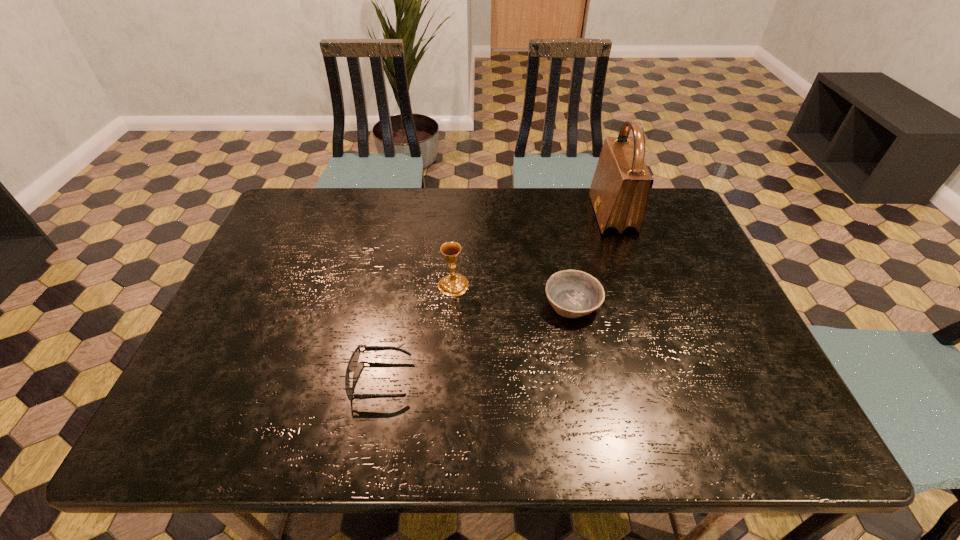
This screenshot has width=960, height=540. I want to click on vacant space that is in between the third object from left to right and the tallest object, so click(x=592, y=259).

Identify which object is the second nearest to the chalice. Please provide its 2D coordinates. Your answer should be formatted as a tuple, i.e. [(x, y)], where the tuple contains the x and y coordinates of a point satisfying the conditions above.

[(572, 293)]

Locate which object is the closest to the rightmost object. Please provide its 2D coordinates. Your answer should be formatted as a tuple, i.e. [(x, y)], where the tuple contains the x and y coordinates of a point satisfying the conditions above.

[(572, 293)]

I want to click on vacant area in the image that satisfies the following two spatial constraints: 1. on the front side of the second object from left to right; 2. on the front-facing side of the shortest object, so click(447, 380).

The image size is (960, 540). What are the coordinates of `free spot that satisfies the following two spatial constraints: 1. on the front side of the third shortest object; 2. on the right side of the second object from right to left` in the screenshot? It's located at (452, 303).